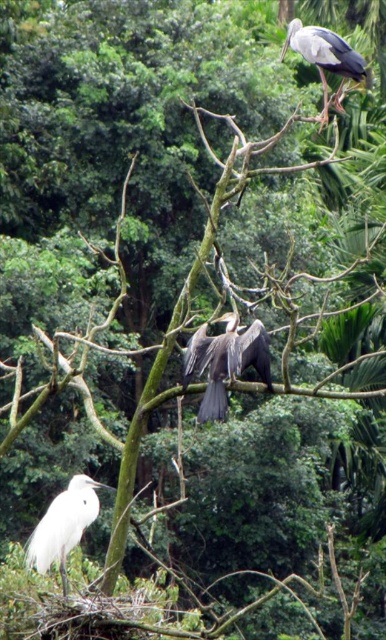
Can you confirm if white feathered bird at lower left is smaller than gray matte bird at upper right?

Yes.

Is point (49, 534) more distant than point (318, 68)?

No, (49, 534) is in front of (318, 68).

Who is more forward, (74,512) or (328,109)?

Point (74,512)

The height and width of the screenshot is (640, 386). I want to click on white feathered bird at lower left, so click(x=64, y=525).

Does dark brown feathers at center have a greater width compared to white feathered bird at lower left?

No, dark brown feathers at center is not wider than white feathered bird at lower left.

The height and width of the screenshot is (640, 386). What do you see at coordinates (225, 360) in the screenshot?
I see `dark brown feathers at center` at bounding box center [225, 360].

You are a GUI agent. You are given a task and a screenshot of the screen. Output one action in this format:
    pyautogui.click(x=<x>, y=<y>)
    Task: Click on the dark brown feathers at center
    The image size is (386, 640).
    Given the screenshot: What is the action you would take?
    pyautogui.click(x=225, y=360)

Consider the image. Can you confirm if dark brown feathers at center is positioned to the left of gray matte bird at upper right?

Correct, you'll find dark brown feathers at center to the left of gray matte bird at upper right.

Which is above, dark brown feathers at center or gray matte bird at upper right?

Positioned higher is gray matte bird at upper right.

Which is in front, point (189, 349) or point (284, 44)?

Point (189, 349) is in front.

You are a GUI agent. You are given a task and a screenshot of the screen. Output one action in this format:
    pyautogui.click(x=<x>, y=<y>)
    Task: Click on the dark brown feathers at center
    The image size is (386, 640).
    Given the screenshot: What is the action you would take?
    pyautogui.click(x=225, y=360)